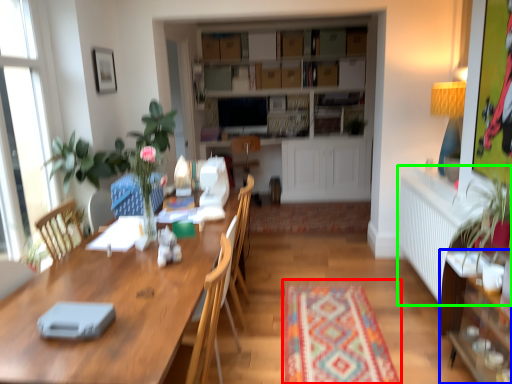
Question: Considering the real-world distances, which object is farthest from mat (highlighted by a red box)? cabinetry (highlighted by a blue box) or radiator (highlighted by a green box)?

Choices:
 (A) cabinetry
 (B) radiator

Answer: (B)